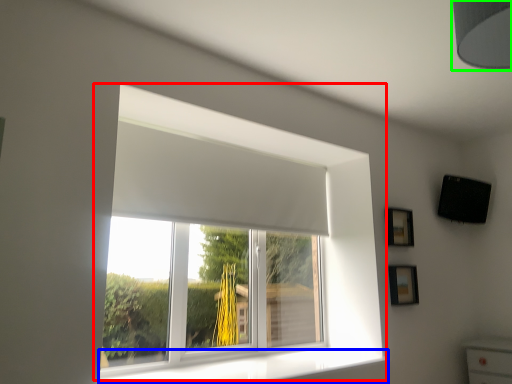
Question: Which is nearer to the window (highlighted by a red box)? window sill (highlighted by a blue box) or lamp (highlighted by a green box).

Choices:
 (A) window sill
 (B) lamp

Answer: (A)